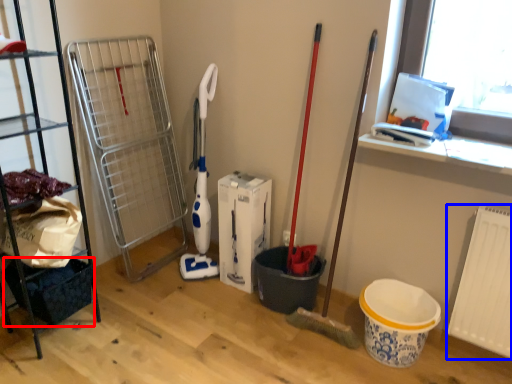
Question: Which object is closer to the camera taking this photo, basket (highlighted by a red box) or radiator (highlighted by a blue box)?

Choices:
 (A) basket
 (B) radiator

Answer: (B)